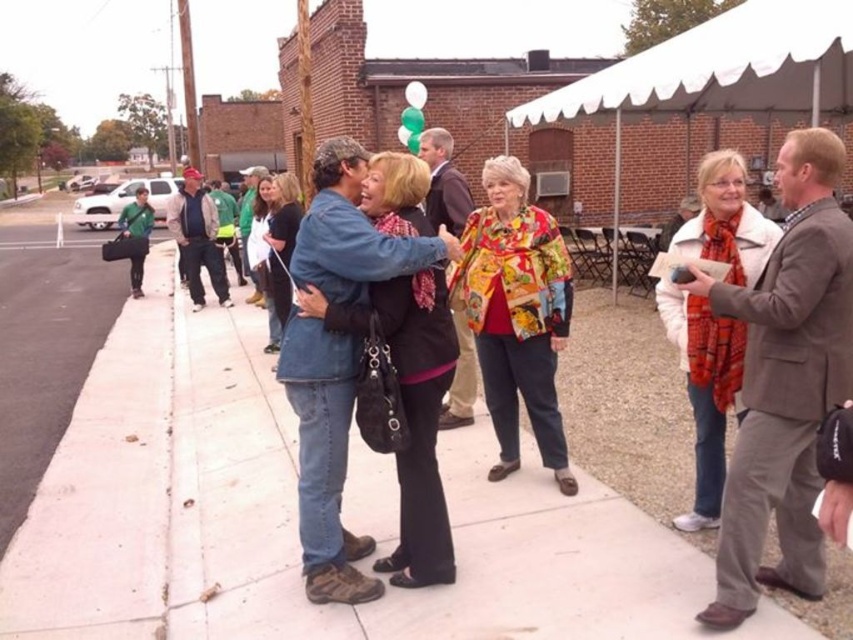
You are planning to set up a small table for a coffee cart on the white concrete sidewalk at center. Considering the space available, will the white canvas canopy at upper center interfere with the placement of the table?

The white concrete sidewalk at center is smaller than the white canvas canopy at upper center, so the canopy might cast a shadow or limit space, but since the sidewalk is smaller, the table can be placed without interference as long as it fits within the sidewalk area.

You are a delivery person trying to navigate from the sidewalk to the canopy tent to drop off a package. Given that your delivery cart is 3 feet wide, can you safely maneuver through the space between the white concrete sidewalk at center and the white canvas canopy at upper center?

The distance between the white concrete sidewalk at center and the white canvas canopy at upper center is 18.95 feet. Since your delivery cart is only 3 feet wide, there is ample space to safely maneuver through the 18.95 feet gap between them.

What is located at the point with coordinates [704,390] in the image?

The white wool scarf at center is located at point [704,390].